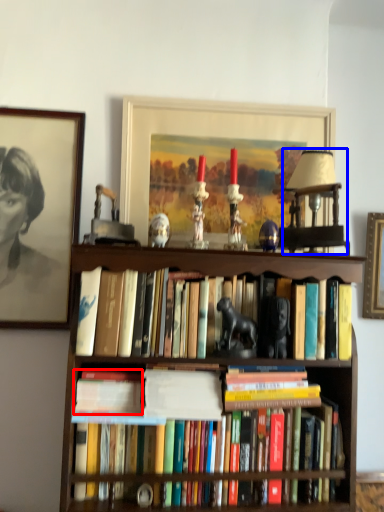
Question: Which of the following is the farthest to the observer, paperback book (highlighted by a red box) or lamp (highlighted by a blue box)?

Choices:
 (A) paperback book
 (B) lamp

Answer: (B)